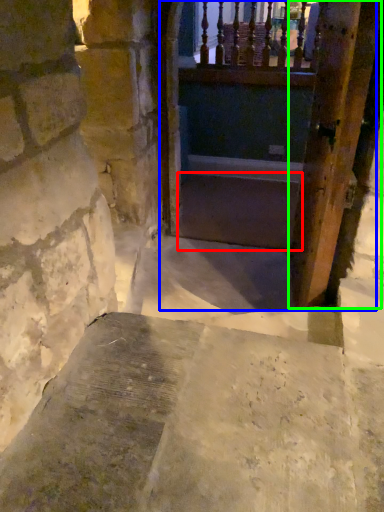
Question: Estimate the real-world distances between objects in this image. Which object is farther from stairs (highlighted by a red box), tunnel (highlighted by a blue box) or door (highlighted by a green box)?

Choices:
 (A) tunnel
 (B) door

Answer: (B)